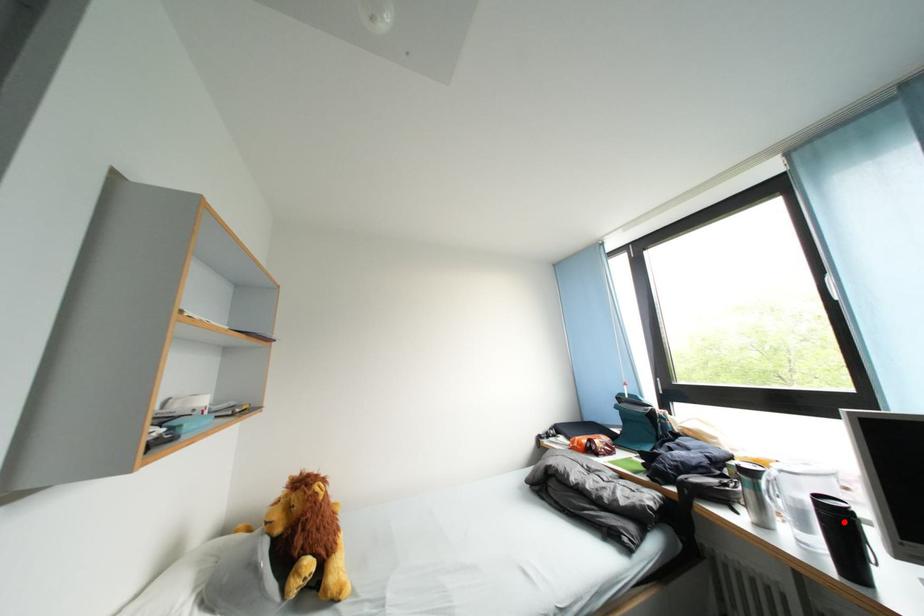
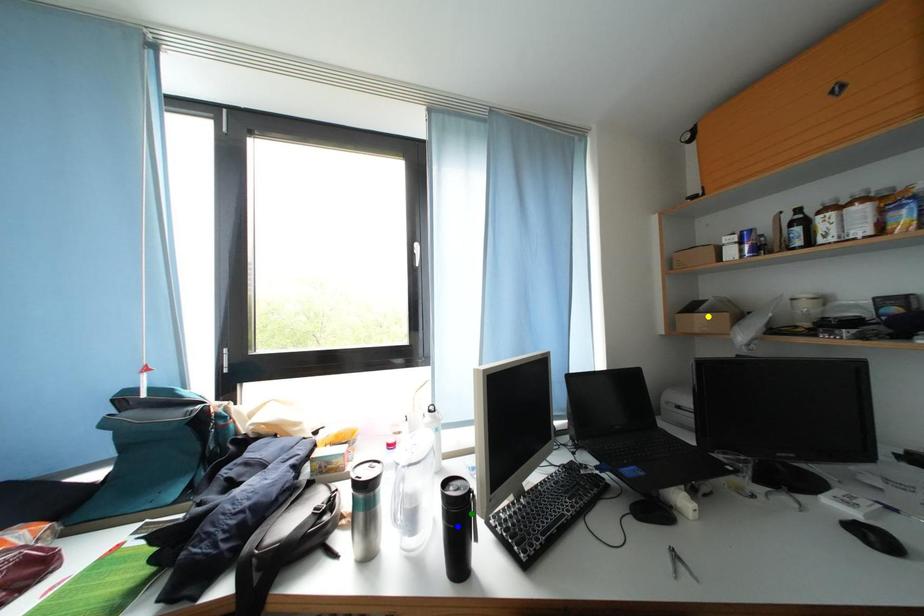
Question: I am providing you with two images of the same scene from different viewpoints. A red point is marked on the first image. You are given multiple points on the second image. Can you choose the point in image 2 that corresponds to the point in image 1?

Choices:
 (A) green point
 (B) yellow point
 (C) blue point

Answer: (A)